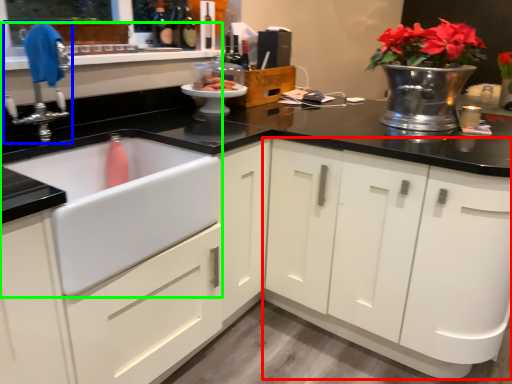
Question: Which object is the farthest from cabinetry (highlighted by a red box)? Choose among these: tap (highlighted by a blue box) or sink (highlighted by a green box).

Choices:
 (A) tap
 (B) sink

Answer: (A)